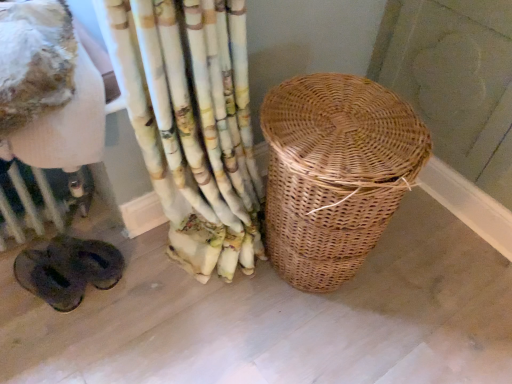
Find the location of a particular element. The width and height of the screenshot is (512, 384). free space to the left of woven brown basket at center is located at coordinates pyautogui.click(x=180, y=294).